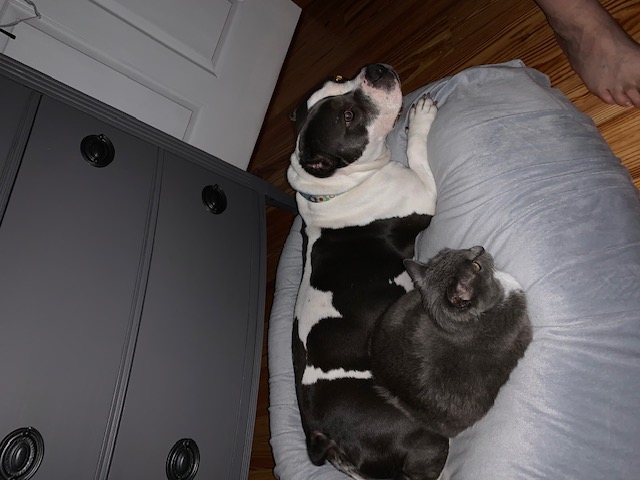
Locate an element on the screen. This screenshot has width=640, height=480. drawers is located at coordinates (282, 71), (219, 184), (513, 10).